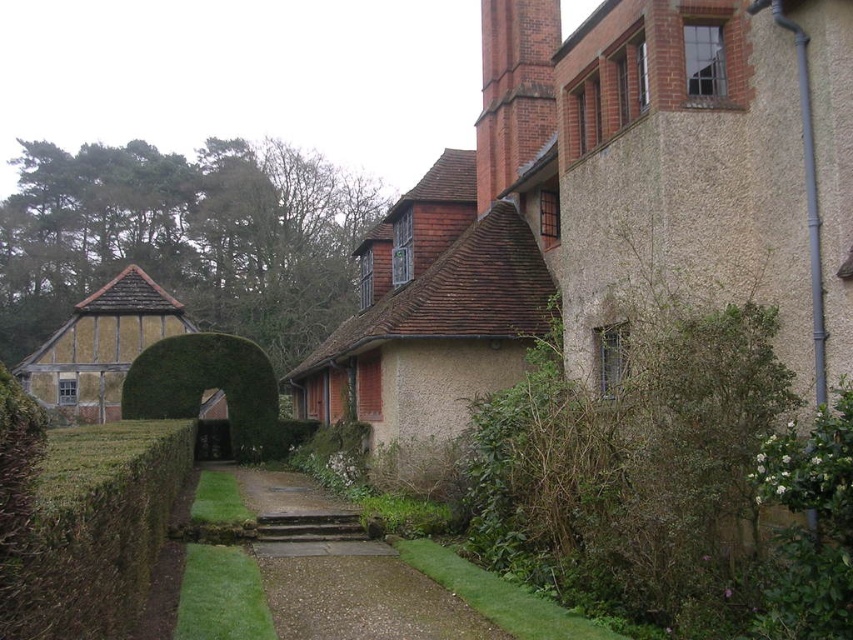
Is green leafy hedge at right thinner than green leafy hedge at center?

Yes, green leafy hedge at right is thinner than green leafy hedge at center.

Describe the element at coordinates (633, 467) in the screenshot. This screenshot has width=853, height=640. I see `green leafy hedge at right` at that location.

The width and height of the screenshot is (853, 640). What do you see at coordinates (633, 467) in the screenshot? I see `green leafy hedge at right` at bounding box center [633, 467].

Find the location of a particular element. The width and height of the screenshot is (853, 640). green leafy hedge at right is located at coordinates (633, 467).

Is green leafy hedge at lower left to the right of green leafy hedge at center from the viewer's perspective?

Yes, green leafy hedge at lower left is to the right of green leafy hedge at center.

Is green leafy hedge at lower left above green leafy hedge at center?

Indeed, green leafy hedge at lower left is positioned over green leafy hedge at center.

Locate an element on the screen. The width and height of the screenshot is (853, 640). green leafy hedge at lower left is located at coordinates click(99, 525).

Where is `green leafy hedge at lower left`? The height and width of the screenshot is (640, 853). green leafy hedge at lower left is located at coordinates (99, 525).

Can you confirm if green leafy hedge at right is positioned to the right of green leafy hedge at lower left?

Correct, you'll find green leafy hedge at right to the right of green leafy hedge at lower left.

Between point (650, 509) and point (47, 605), which one is positioned behind?

Positioned behind is point (650, 509).

Find the location of a particular element. This screenshot has width=853, height=640. green leafy hedge at right is located at coordinates (633, 467).